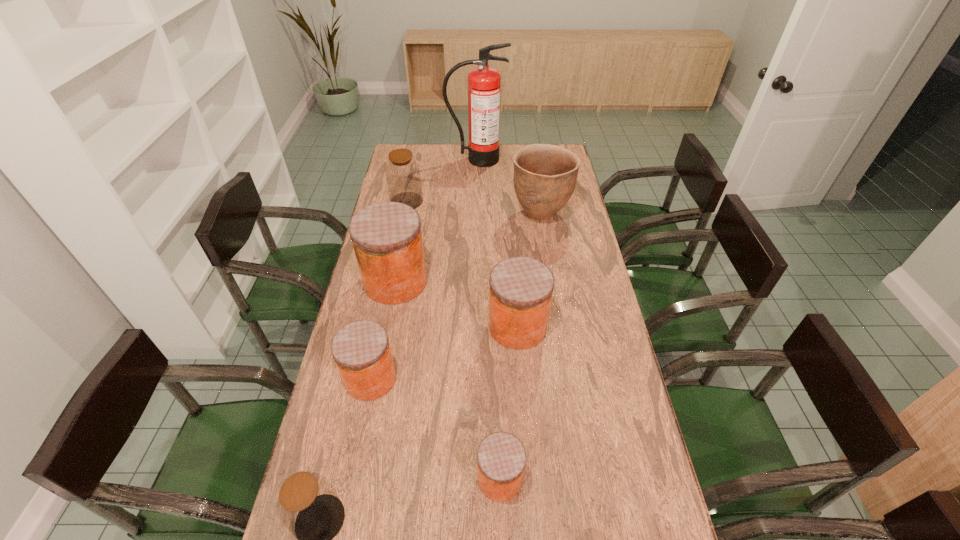
Locate an element on the screen. This screenshot has height=540, width=960. orange jar that stands as the closest to the pottery is located at coordinates (387, 239).

This screenshot has height=540, width=960. Identify the location of orange jar that is the closest to the second biggest orange jar. (387, 239).

At what (x,y) coordinates should I click in order to perform the action: click on the closest brown jar to the smallest orange jar. Please return your answer as a coordinate pair (x, y). The width and height of the screenshot is (960, 540). Looking at the image, I should click on (307, 504).

Where is `the second closest brown jar relative to the pottery`? This screenshot has height=540, width=960. the second closest brown jar relative to the pottery is located at coordinates (307, 504).